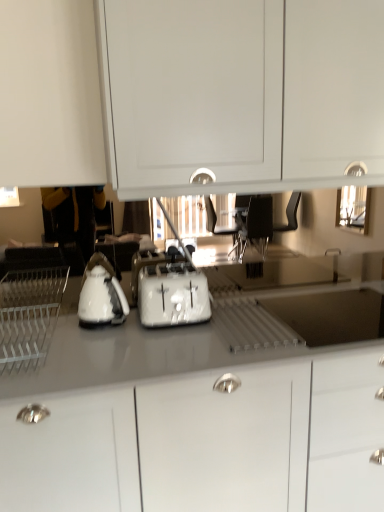
The image size is (384, 512). In order to click on vacant region above white glossy cabinet at center, acting as the 2th cabinetry starting from the top (from a real-world perspective) in this screenshot , I will do `click(218, 328)`.